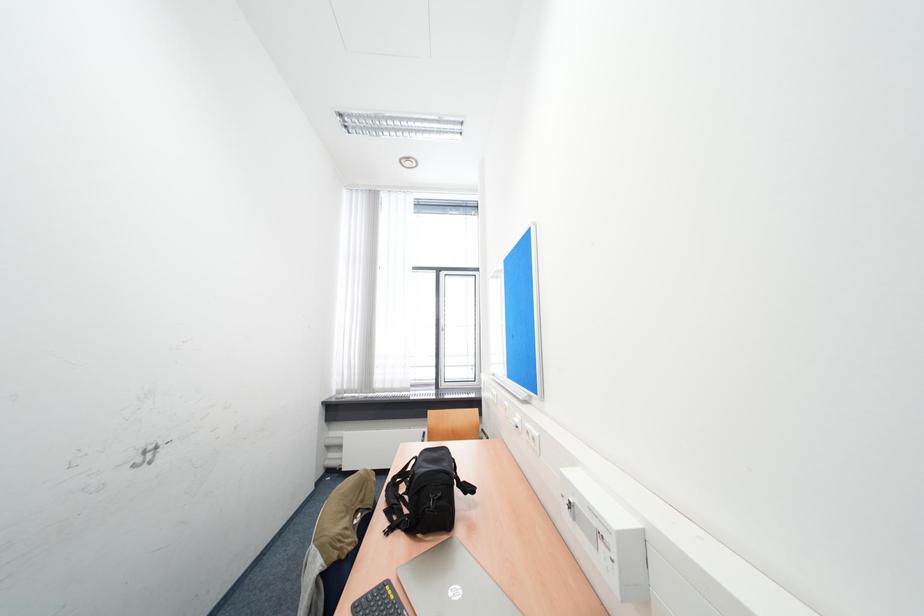
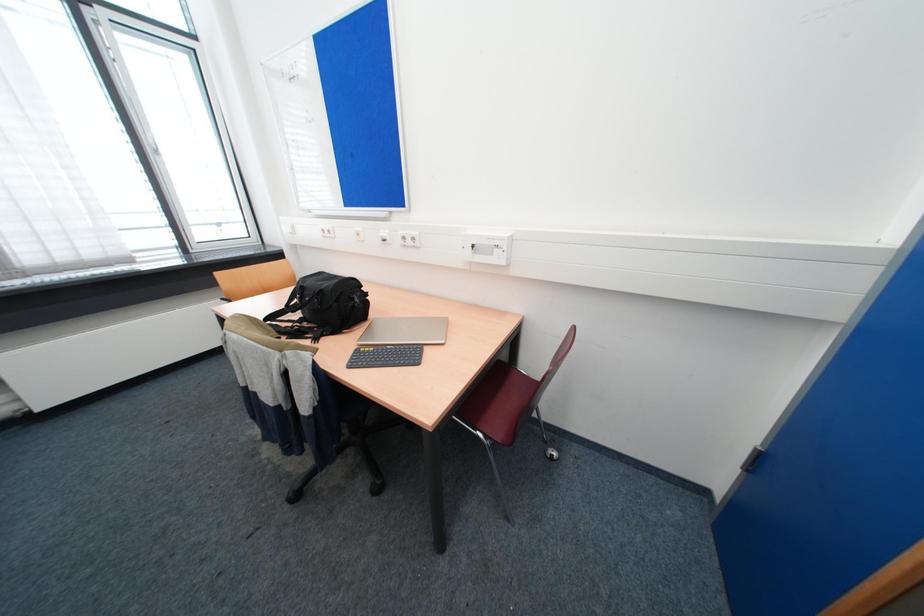
Based on the continuous images, in which direction is the camera rotating?

The rotation direction of the camera is right-down.